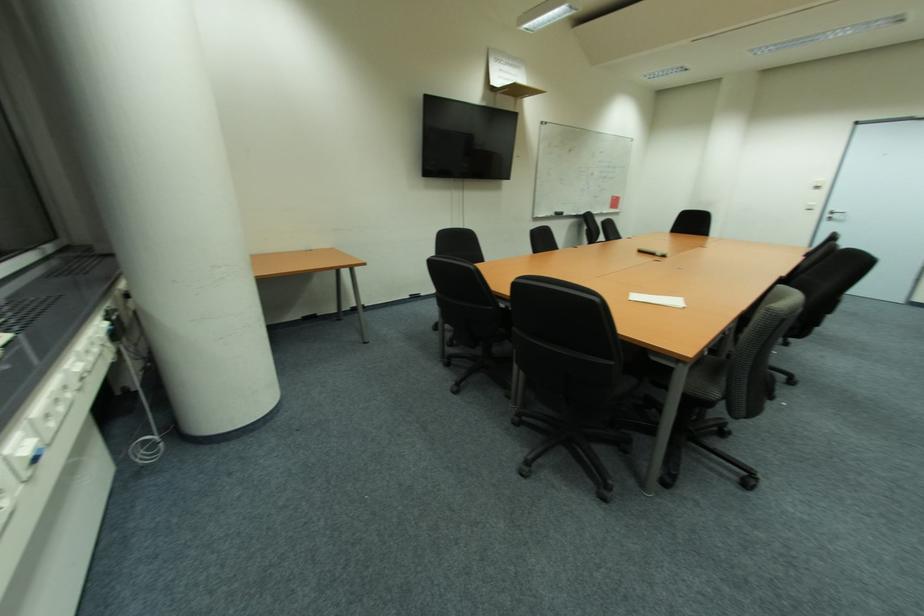
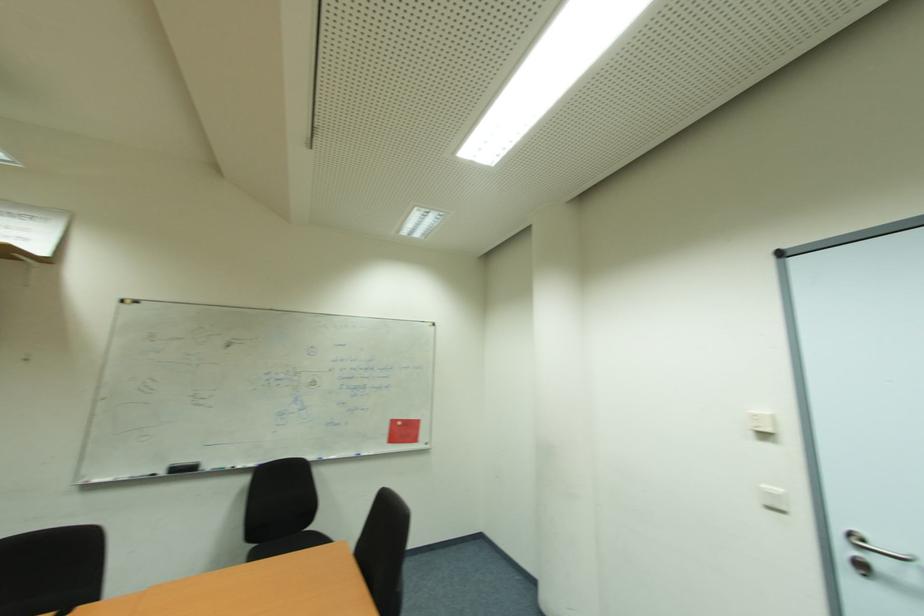
The point at (618, 198) is marked in the first image. Where is the corresponding point in the second image?

(397, 423)